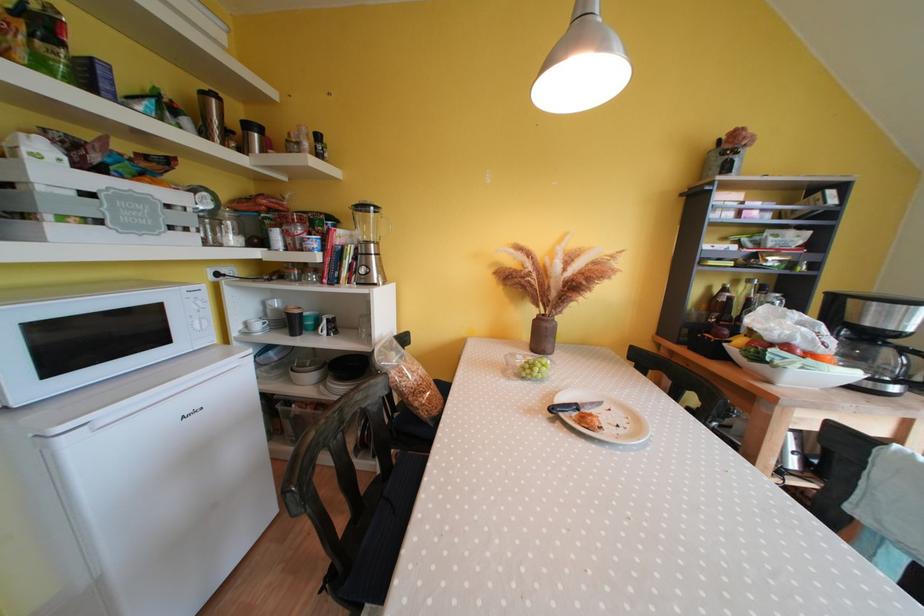
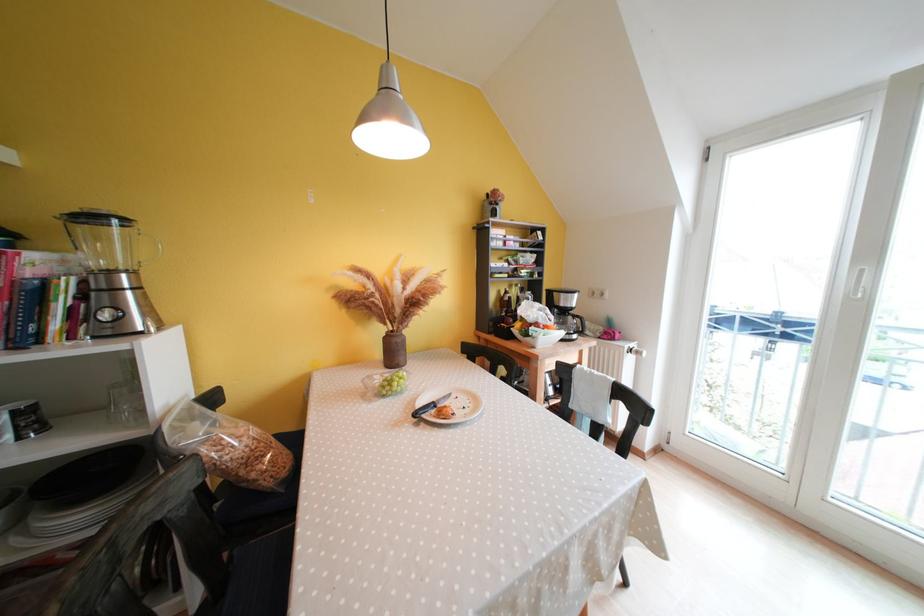
Question: The camera is either moving clockwise (left) or counter-clockwise (right) around the object. The first image is from the beginning of the video and the second image is from the end. Is the camera moving left or right when shooting the video?

Choices:
 (A) Left
 (B) Right

Answer: (A)